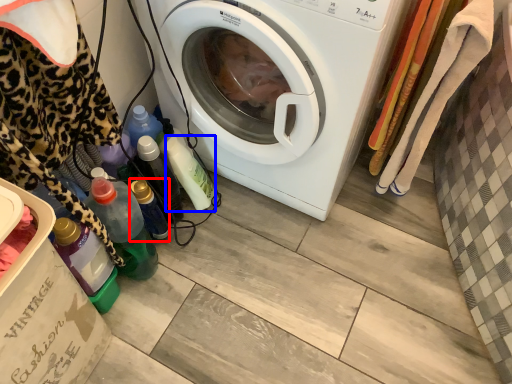
Question: Which point is further to the camera, bottle (highlighted by a red box) or bottle (highlighted by a blue box)?

Choices:
 (A) bottle
 (B) bottle

Answer: (B)